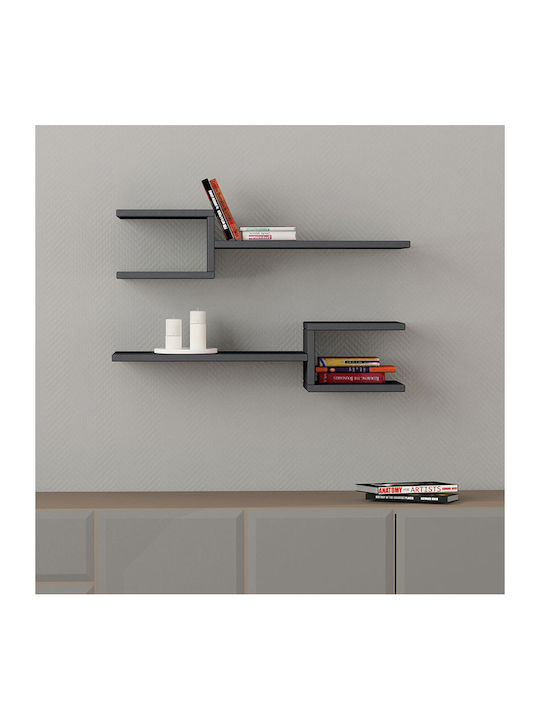
The height and width of the screenshot is (720, 540). In order to click on shelves in this screenshot , I will do `click(175, 209)`, `click(174, 274)`, `click(320, 243)`, `click(259, 355)`, `click(363, 325)`, `click(382, 387)`.